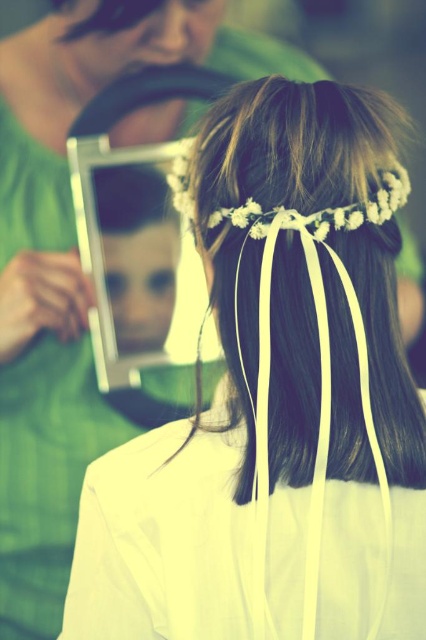
Question: Does metallic silver frame at upper center have a lesser width compared to silky brown hair at upper center?

Choices:
 (A) yes
 (B) no

Answer: (B)

Question: Is metallic silver frame at upper center below silky brown hair at upper center?

Choices:
 (A) yes
 (B) no

Answer: (A)

Question: Can you confirm if metallic silver frame at upper center is positioned below silky brown hair at upper center?

Choices:
 (A) no
 (B) yes

Answer: (B)

Question: Which of the following is the closest to the observer?

Choices:
 (A) (63, 115)
 (B) (140, 17)

Answer: (A)

Question: Among these points, which one is farthest from the camera?

Choices:
 (A) (34, 80)
 (B) (75, 3)

Answer: (A)